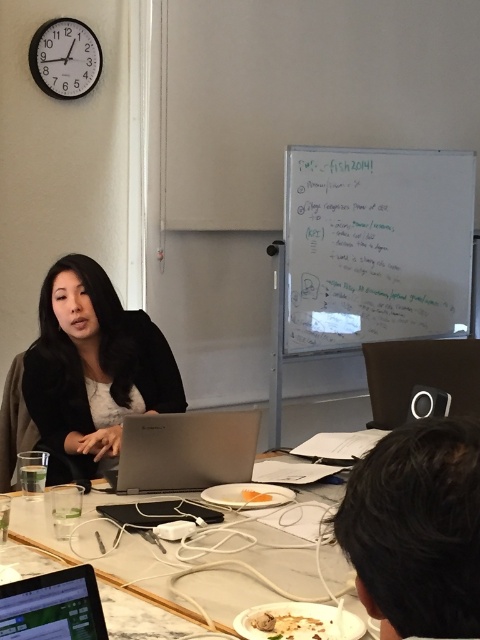
In the scene shown: You are standing in front of the table in the office scene. You need to place a 50 cm wide object on the table. Is there enough space between the dark brown hair at lower right and the edge of the table to accommodate it?

The distance between the dark brown hair at lower right and the viewer is 55.01 centimeters. Since the object is 50 cm wide, there is sufficient space to place it between the dark brown hair at lower right and the edge of the table.

You are standing in the office scene and want to hand a document to the woman. You see the dark brown hair at lower right and the silver metallic laptop at lower left. Which object is closer to you so you can place the document near it?

The dark brown hair at lower right is closer to the viewer than the silver metallic laptop at lower left, so you can place the document near the dark brown hair at lower right.